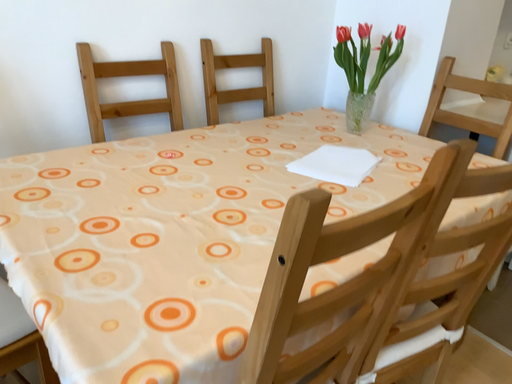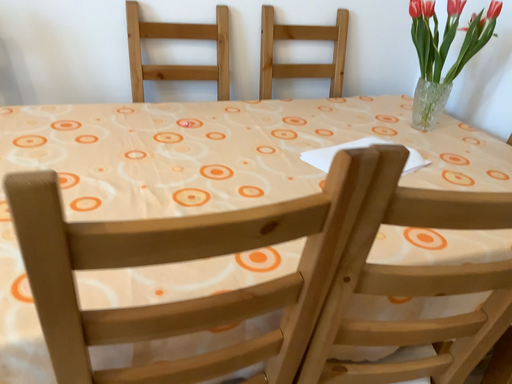
Question: Which way did the camera rotate in the video?

Choices:
 (A) rotated right
 (B) rotated left

Answer: (B)